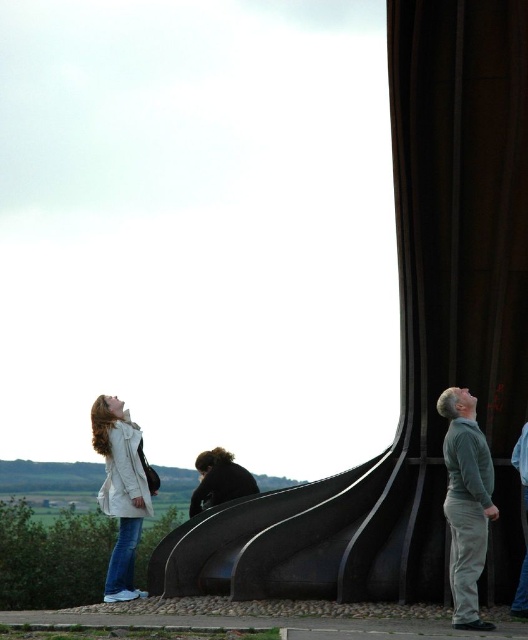
Does gray-green fleece jacket at right have a larger size compared to white matte jacket at lower left?

Incorrect, gray-green fleece jacket at right is not larger than white matte jacket at lower left.

What do you see at coordinates (466, 502) in the screenshot?
I see `gray-green fleece jacket at right` at bounding box center [466, 502].

At what (x,y) coordinates should I click in order to perform the action: click on gray-green fleece jacket at right. Please return your answer as a coordinate pair (x, y). The width and height of the screenshot is (528, 640). Looking at the image, I should click on (466, 502).

Which is behind, point (501, 410) or point (133, 506)?

Positioned behind is point (133, 506).

Does black matte curtain at right appear over white matte jacket at lower left?

Yes.

What do you see at coordinates (456, 269) in the screenshot?
I see `black matte curtain at right` at bounding box center [456, 269].

I want to click on black matte curtain at right, so click(x=456, y=269).

Can you confirm if black matte curtain at right is shorter than gray-green fleece jacket at right?

No.

Based on the photo, who is higher up, black matte curtain at right or gray-green fleece jacket at right?

Positioned higher is black matte curtain at right.

Does point (422, 115) come behind point (449, 444)?

Yes, point (422, 115) is behind point (449, 444).

The height and width of the screenshot is (640, 528). Find the location of `black matte curtain at right`. black matte curtain at right is located at coordinates (456, 269).